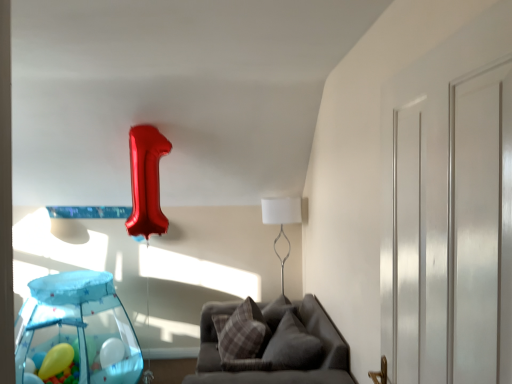
Question: Is white glossy door at right completely or partially inside gray fabric couch at lower center?

Choices:
 (A) yes
 (B) no

Answer: (B)

Question: Does gray fabric couch at lower center come behind white glossy door at right?

Choices:
 (A) no
 (B) yes

Answer: (B)

Question: From the image's perspective, is gray fabric couch at lower center over white glossy door at right?

Choices:
 (A) yes
 (B) no

Answer: (B)

Question: Does gray fabric couch at lower center have a greater height compared to white glossy door at right?

Choices:
 (A) no
 (B) yes

Answer: (A)

Question: From a real-world perspective, is gray fabric couch at lower center positioned under white glossy door at right based on gravity?

Choices:
 (A) no
 (B) yes

Answer: (B)

Question: Considering the positions of point (268, 329) and point (314, 357), is point (268, 329) closer or farther from the camera than point (314, 357)?

Choices:
 (A) farther
 (B) closer

Answer: (A)

Question: Is plaid fabric pillow at center, the 1th pillow from the left, wider or thinner than plush gray pillow at center, acting as the first pillow starting from the right?

Choices:
 (A) thin
 (B) wide

Answer: (A)

Question: In the image, is plaid fabric pillow at center, which appears as the second pillow when viewed from the right, on the left side or the right side of plush gray pillow at center, acting as the first pillow starting from the right?

Choices:
 (A) left
 (B) right

Answer: (A)

Question: Considering the positions of plaid fabric pillow at center, which appears as the second pillow when viewed from the right, and plush gray pillow at center, acting as the first pillow starting from the right, in the image, is plaid fabric pillow at center, which appears as the second pillow when viewed from the right, bigger or smaller than plush gray pillow at center, acting as the first pillow starting from the right,?

Choices:
 (A) small
 (B) big

Answer: (B)

Question: Considering the positions of white metallic table lamp at center and translucent blue playpen at lower left in the image, is white metallic table lamp at center bigger or smaller than translucent blue playpen at lower left?

Choices:
 (A) small
 (B) big

Answer: (A)

Question: Is white metallic table lamp at center wider or thinner than translucent blue playpen at lower left?

Choices:
 (A) thin
 (B) wide

Answer: (A)

Question: From the image's perspective, is white metallic table lamp at center positioned above or below translucent blue playpen at lower left?

Choices:
 (A) below
 (B) above

Answer: (B)

Question: Considering their positions, is white metallic table lamp at center located in front of or behind translucent blue playpen at lower left?

Choices:
 (A) behind
 (B) front

Answer: (A)

Question: Is white metallic table lamp at center to the left or to the right of white glossy door at right in the image?

Choices:
 (A) right
 (B) left

Answer: (B)

Question: From a real-world perspective, is white metallic table lamp at center positioned above or below white glossy door at right?

Choices:
 (A) above
 (B) below

Answer: (B)